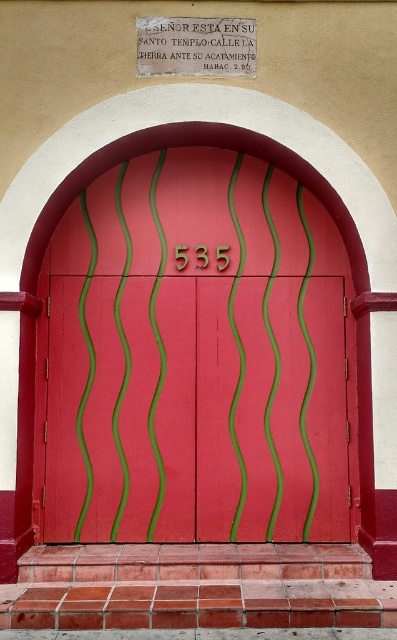
You are standing in front of the entrance and want to read the text on the plaque. Which object should you look at first, the matte red wooden door at center or the matte white stone plaque at upper center?

You should look at the matte white stone plaque at upper center first because it is above the matte red wooden door at center and positioned higher up.

You are an architect designing a new building and want to replicate the door and plaque seen in the image. If you have a space that can only accommodate objects up to the size of the matte white stone plaque at upper center, will the matte red wooden door at center fit in that space?

The matte red wooden door at center is larger in size than the matte white stone plaque at upper center, so it will not fit in the space allocated for the plaque.